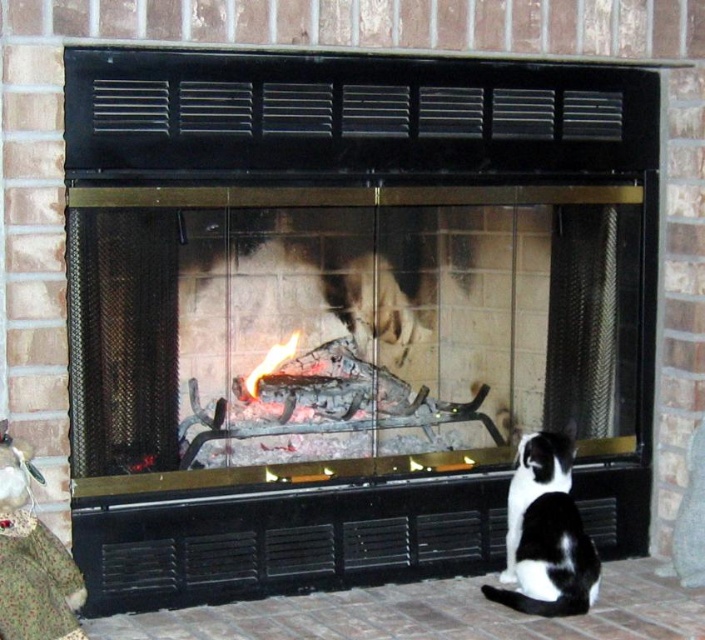
Question: Is black and white fur cat at lower right above flamematerial/texture at center?

Choices:
 (A) no
 (B) yes

Answer: (A)

Question: Does black and white fur cat at lower right have a lesser width compared to flamematerial/texture at center?

Choices:
 (A) no
 (B) yes

Answer: (A)

Question: Is black and white fur cat at lower right to the left of flamematerial/texture at center from the viewer's perspective?

Choices:
 (A) yes
 (B) no

Answer: (B)

Question: Which point is closer to the camera?

Choices:
 (A) (515, 518)
 (B) (286, 356)

Answer: (A)

Question: Which object is closer to the camera taking this photo?

Choices:
 (A) black and white fur cat at lower right
 (B) flamematerial/texture at center

Answer: (A)

Question: Among these points, which one is farthest from the camera?

Choices:
 (A) (572, 563)
 (B) (259, 362)

Answer: (B)